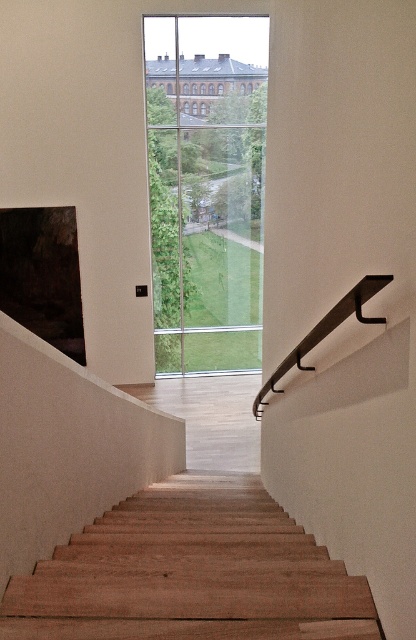
You are standing at the bottom of the staircase and want to look through the clear glass window at center. To do this, which direction should you move relative to the black metal handrail at upper right?

The clear glass window at center is to the left of the black metal handrail at upper right, so you should move to the left relative to the black metal handrail at upper right to look through the window.

Looking at this image, you are standing at the bottom of the wooden stairs at center. You want to look up to the clear glass window at center. Can you see the historic building with red brick walls through the window?

The wooden stairs at center is positioned under the clear glass window at center, so yes, you can see the historic building with red brick walls through the clear glass window at center because the window is above the stairs and provides an unobstructed view.

You are an architect designing a new building and want to ensure the clear glass window at center and the black metal handrail at upper right are proportionate. Based on the scene, which object has a greater width?

The clear glass window at center has a greater width than the black metal handrail at upper right according to the description.